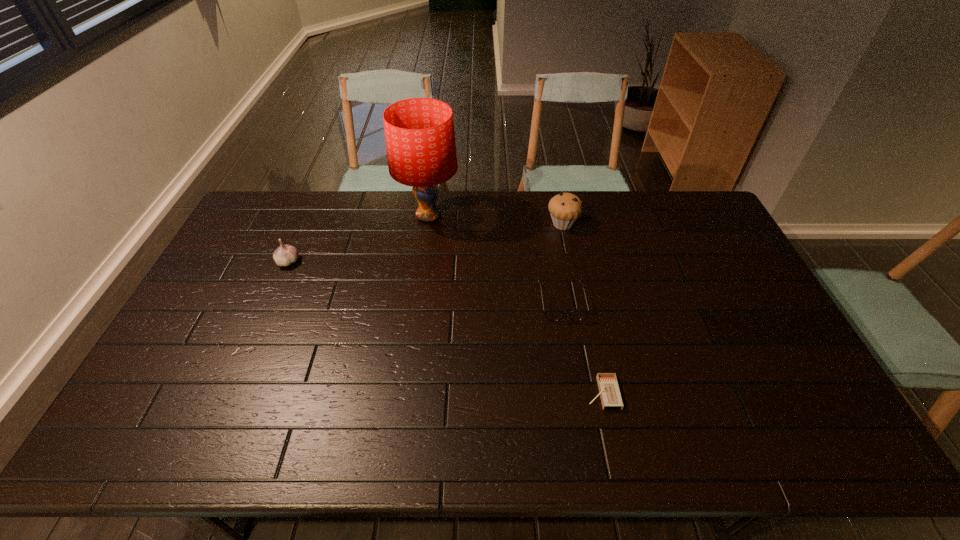
At what (x,y) coordinates should I click in order to perform the action: click on free space that satisfies the following two spatial constraints: 1. on the back side of the fourth shortest object; 2. on the front-facing side of the second object from left to right. Please return your answer as a coordinate pair (x, y). The image size is (960, 540). Looking at the image, I should click on (561, 216).